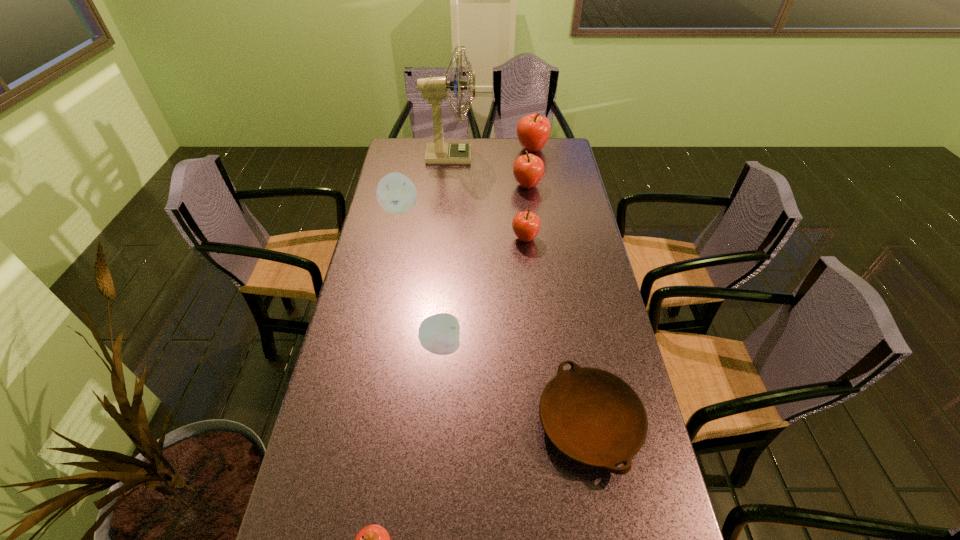
The height and width of the screenshot is (540, 960). I want to click on vacant region between the third nearest object and the fan, so click(x=445, y=251).

Identify the location of free space that is in between the fourth farthest apple and the smaller white apple. (483, 292).

At what (x,y) coordinates should I click in order to perform the action: click on free area in between the fourth farthest apple and the tallest object. Please return your answer as a coordinate pair (x, y). The height and width of the screenshot is (540, 960). Looking at the image, I should click on (488, 197).

In order to click on free spot between the farther white apple and the fan in this screenshot , I will do `click(425, 183)`.

Identify which object is the second closest to the third farthest object. Please provide its 2D coordinates. Your answer should be formatted as a tuple, i.e. [(x, y)], where the tuple contains the x and y coordinates of a point satisfying the conditions above.

[(435, 89)]

Identify which object is located as the sixth nearest to the left white apple. Please provide its 2D coordinates. Your answer should be formatted as a tuple, i.e. [(x, y)], where the tuple contains the x and y coordinates of a point satisfying the conditions above.

[(592, 416)]

You are a GUI agent. You are given a task and a screenshot of the screen. Output one action in this format:
    pyautogui.click(x=<x>, y=<y>)
    Task: Click on the third closest apple relative to the farther white apple
    This screenshot has width=960, height=540.
    Given the screenshot: What is the action you would take?
    pyautogui.click(x=533, y=131)

At what (x,y) coordinates should I click in order to perform the action: click on the second closest apple to the farthest pink apple. Please return your answer as a coordinate pair (x, y). This screenshot has width=960, height=540. Looking at the image, I should click on (526, 225).

The width and height of the screenshot is (960, 540). I want to click on the second closest pink apple to the fourth farthest apple, so (533, 131).

This screenshot has width=960, height=540. Find the location of `the second closest pink apple to the shortest apple`. the second closest pink apple to the shortest apple is located at coordinates (528, 169).